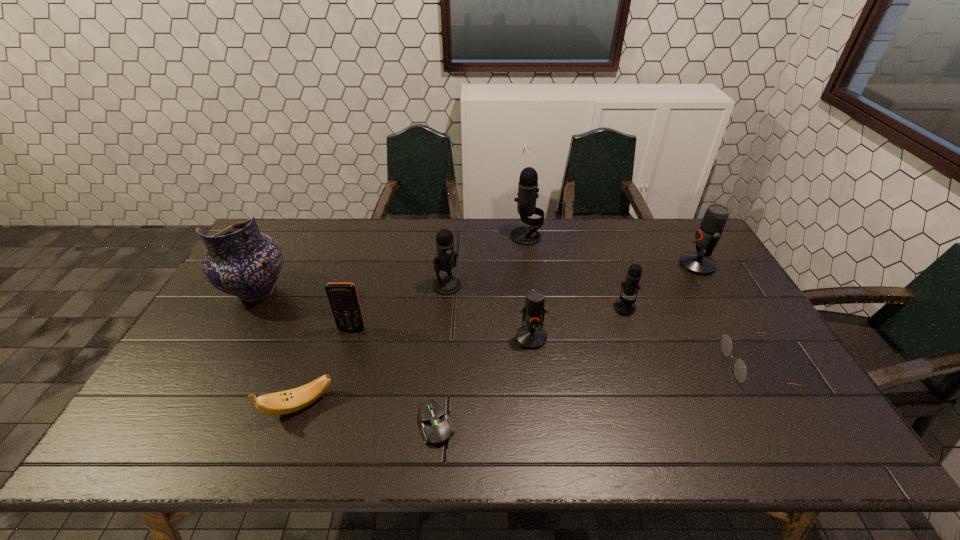
Where is `the farthest microphone`? This screenshot has width=960, height=540. the farthest microphone is located at coordinates (528, 188).

Where is `the farthest black microphone`? the farthest black microphone is located at coordinates (528, 188).

This screenshot has height=540, width=960. Find the location of `blue pottery`. blue pottery is located at coordinates point(240,261).

Where is `pottery`? The height and width of the screenshot is (540, 960). pottery is located at coordinates (240, 261).

Find the location of a particular element. This screenshot has height=540, width=960. the farther red microphone is located at coordinates (707, 237).

Image resolution: width=960 pixels, height=540 pixels. In order to click on the rightmost microphone in this screenshot , I will do `click(707, 237)`.

Where is `the second biggest black microphone`? the second biggest black microphone is located at coordinates (446, 257).

Where is `the third farthest microphone`? Image resolution: width=960 pixels, height=540 pixels. the third farthest microphone is located at coordinates pyautogui.click(x=446, y=257).

Locate an element on the screen. The height and width of the screenshot is (540, 960). cellular telephone is located at coordinates (343, 298).

At what (x,y) coordinates should I click in order to perform the action: click on the fourth microphone from left to right. Please return your answer as a coordinate pair (x, y). The height and width of the screenshot is (540, 960). Looking at the image, I should click on (623, 306).